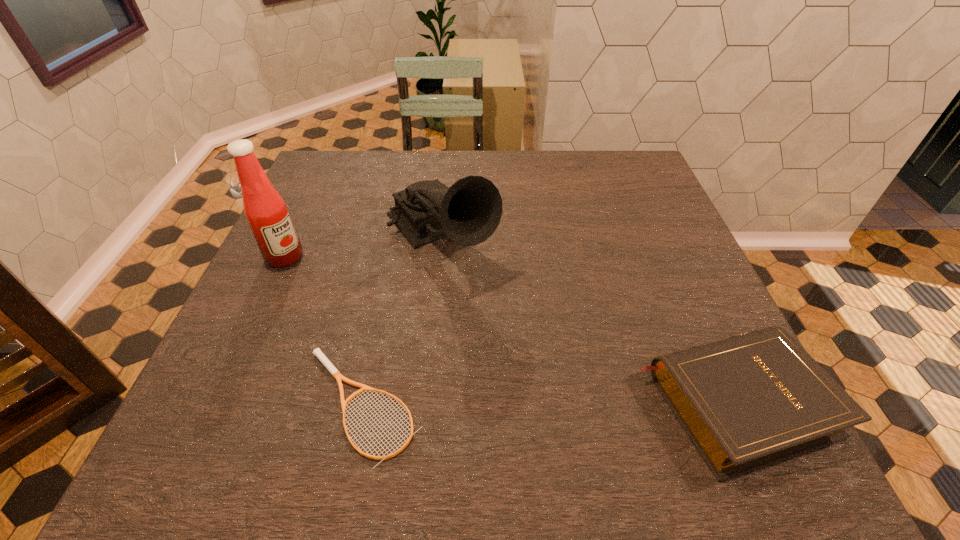
The image size is (960, 540). I want to click on free spot on the desktop that is between the shortest object and the Bible and is positioned on the front-facing side of the condiment, so click(501, 404).

Locate an element on the screen. The width and height of the screenshot is (960, 540). free space on the desktop that is between the tennis racket and the rightmost object and is positioned from the horn of the second tallest object is located at coordinates (584, 403).